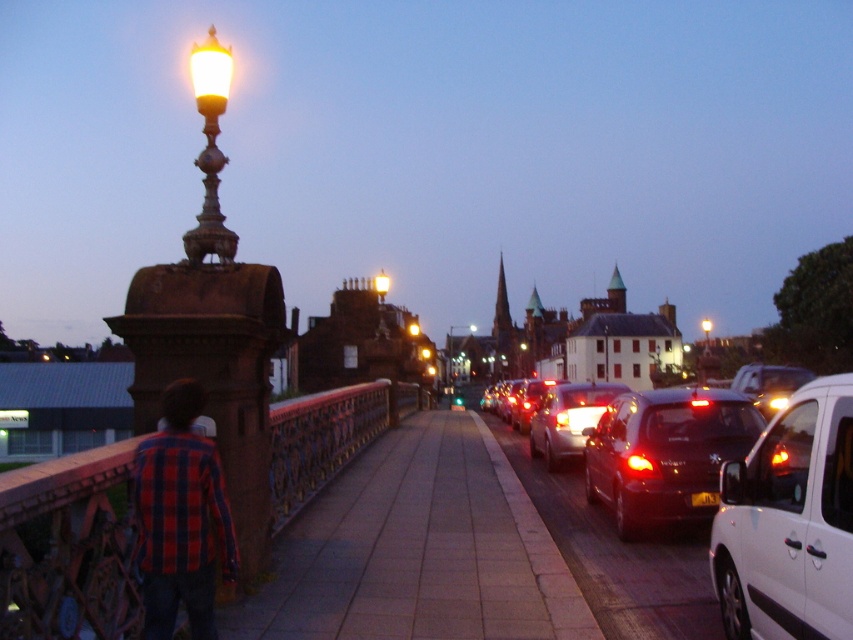
Is green glass street light at center further to camera compared to shiny black sedan at center right?

Yes, it is.

In the scene shown: Does green glass street light at center have a greater height compared to shiny black sedan at center right?

Yes.

Identify the location of green glass street light at center. (463, 364).

Find the location of a particular element. The height and width of the screenshot is (640, 853). green glass street light at center is located at coordinates (463, 364).

Who is taller, metallic brown bridge at center or green glass street light at center?

green glass street light at center

Is point (10, 540) positioned in front of point (471, 387)?

That is True.

The width and height of the screenshot is (853, 640). What are the coordinates of `metallic brown bridge at center` in the screenshot? It's located at (68, 548).

Is metallic silver car at right wider than matte brass streetlight at center?

No, metallic silver car at right is not wider than matte brass streetlight at center.

Which is in front, point (764, 378) or point (387, 282)?

Point (764, 378) is more forward.

This screenshot has height=640, width=853. I want to click on metallic silver car at right, so click(x=769, y=385).